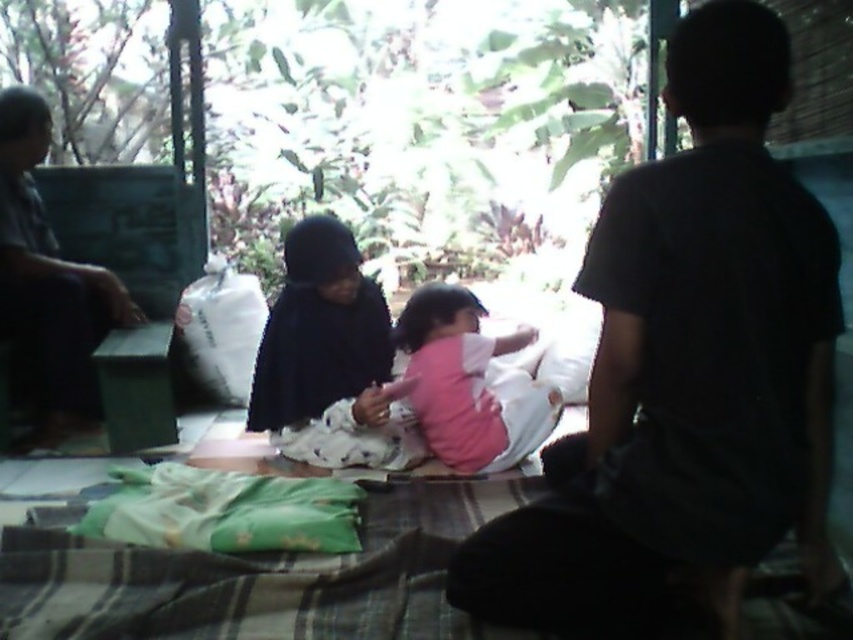
Does dark gray fabric at left come behind pink matte shirt at center?

Yes.

Which is below, dark gray fabric at left or pink matte shirt at center?

Positioned lower is pink matte shirt at center.

Is point (56, 410) closer to viewer compared to point (525, 401)?

No, it is behind (525, 401).

Where is `dark gray fabric at left`? The width and height of the screenshot is (853, 640). dark gray fabric at left is located at coordinates click(x=49, y=282).

Looking at this image, can you confirm if dark gray shirt at center is positioned to the left of pink matte shirt at center?

No, dark gray shirt at center is not to the left of pink matte shirt at center.

Does dark gray shirt at center have a smaller size compared to pink matte shirt at center?

Actually, dark gray shirt at center might be larger than pink matte shirt at center.

The width and height of the screenshot is (853, 640). What do you see at coordinates (688, 371) in the screenshot?
I see `dark gray shirt at center` at bounding box center [688, 371].

Locate an element on the screen. The height and width of the screenshot is (640, 853). dark gray shirt at center is located at coordinates (688, 371).

The width and height of the screenshot is (853, 640). I want to click on black matte clothing at center, so click(x=318, y=330).